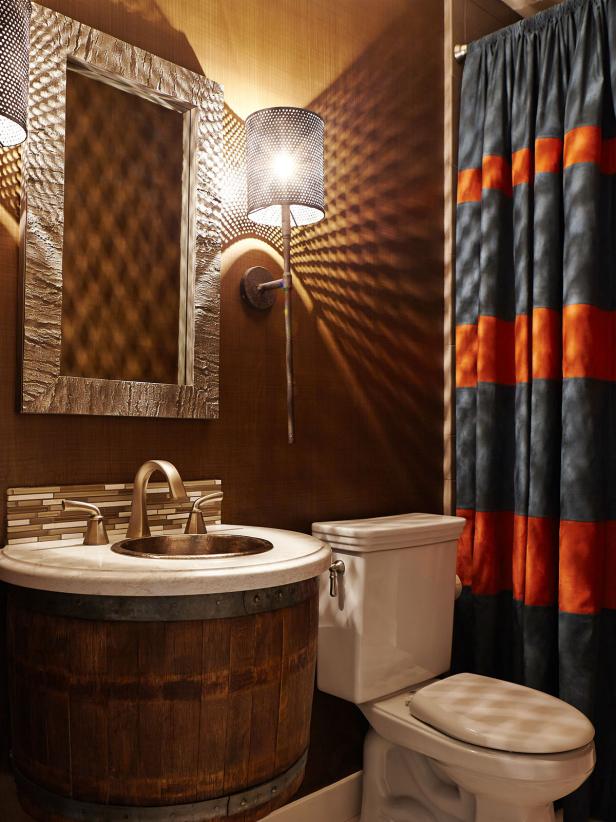
You are a GUI agent. You are given a task and a screenshot of the screen. Output one action in this format:
    pyautogui.click(x=<x>, y=<y>)
    Task: Click on the mirror frame
    
    Given the screenshot: What is the action you would take?
    pyautogui.click(x=192, y=411)